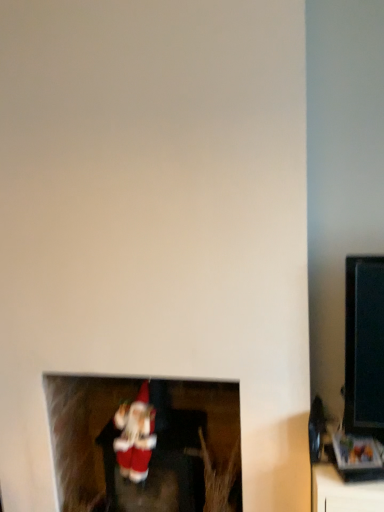
What is the approximate width of red plush santa at lower center?

22.10 centimeters.

Measure the distance between point (118, 411) and camera.

Point (118, 411) and camera are 1.79 meters apart from each other.

Find the location of a particular element. red plush santa at lower center is located at coordinates (135, 436).

Based on the photo, measure the distance between red plush santa at lower center and camera.

They are 1.63 meters apart.

This screenshot has width=384, height=512. What do you see at coordinates (135, 436) in the screenshot?
I see `red plush santa at lower center` at bounding box center [135, 436].

You are a GUI agent. You are given a task and a screenshot of the screen. Output one action in this format:
    pyautogui.click(x=<x>, y=<y>)
    Task: Click on the velvet santa at lower center
    The image size is (384, 512).
    Given the screenshot: What is the action you would take?
    pyautogui.click(x=145, y=444)

What do you see at coordinates (145, 444) in the screenshot? I see `velvet santa at lower center` at bounding box center [145, 444].

Identify the location of red plush santa at lower center. (135, 436).

Which object is positioned more to the left, red plush santa at lower center or velvet santa at lower center?

red plush santa at lower center.

Who is more distant, red plush santa at lower center or velvet santa at lower center?

velvet santa at lower center.

Considering the positions of points (148, 456) and (107, 503), is point (148, 456) farther from camera compared to point (107, 503)?

That is False.

From the image's perspective, is red plush santa at lower center located above velvet santa at lower center?

Correct, red plush santa at lower center appears higher than velvet santa at lower center in the image.

From a real-world perspective, which is physically below, red plush santa at lower center or velvet santa at lower center?

In real-world perspective, velvet santa at lower center is lower.

Does red plush santa at lower center have a greater width compared to velvet santa at lower center?

Incorrect, the width of red plush santa at lower center does not surpass that of velvet santa at lower center.

Who is shorter, red plush santa at lower center or velvet santa at lower center?

Standing shorter between the two is red plush santa at lower center.

Looking at the image, does red plush santa at lower center seem bigger or smaller compared to velvet santa at lower center?

Considering their sizes, red plush santa at lower center takes up less space than velvet santa at lower center.

Is red plush santa at lower center spatially inside velvet santa at lower center, or outside of it?

red plush santa at lower center fits inside velvet santa at lower center.

Are red plush santa at lower center and velvet santa at lower center located far from each other?

That's not correct — red plush santa at lower center is a little close to velvet santa at lower center.

Is red plush santa at lower center aimed at velvet santa at lower center?

Yes, red plush santa at lower center faces towards velvet santa at lower center.

How different are the orientations of red plush santa at lower center and velvet santa at lower center in degrees?

2.26 degrees separate the facing orientations of red plush santa at lower center and velvet santa at lower center.

This screenshot has height=512, width=384. I want to click on fireplace that appears on the right of red plush santa at lower center, so click(x=145, y=444).

Is velvet santa at lower center at the right side of red plush santa at lower center?

Yes, velvet santa at lower center is to the right of red plush santa at lower center.

Which object is closer to the camera taking this photo, velvet santa at lower center or red plush santa at lower center?

red plush santa at lower center is closer to the camera.

Is point (91, 377) closer or farther from the camera than point (129, 435)?

Clearly, point (91, 377) is more distant from the camera than point (129, 435).

From the image's perspective, which is above, velvet santa at lower center or red plush santa at lower center?

red plush santa at lower center is shown above in the image.

From a real-world perspective, relative to red plush santa at lower center, is velvet santa at lower center vertically above or below?

In terms of real-world spatial position, velvet santa at lower center is below red plush santa at lower center.

Considering the relative sizes of velvet santa at lower center and red plush santa at lower center in the image provided, is velvet santa at lower center wider than red plush santa at lower center?

Indeed, velvet santa at lower center has a greater width compared to red plush santa at lower center.

Is velvet santa at lower center taller than red plush santa at lower center?

Yes.

Considering the sizes of objects velvet santa at lower center and red plush santa at lower center in the image provided, who is smaller, velvet santa at lower center or red plush santa at lower center?

With smaller size is red plush santa at lower center.

Which is correct: velvet santa at lower center is inside red plush santa at lower center, or outside of it?

velvet santa at lower center lies outside red plush santa at lower center.

Are velvet santa at lower center and red plush santa at lower center beside each other?

No, velvet santa at lower center is not in contact with red plush santa at lower center.

Is velvet santa at lower center positioned with its back to red plush santa at lower center?

Yes.

Find the location of `santa claus located above the velvet santa at lower center (from the image's perspective)`. santa claus located above the velvet santa at lower center (from the image's perspective) is located at coordinates (135, 436).

At what (x,y) coordinates should I click in order to perform the action: click on santa claus that is in front of the velvet santa at lower center. Please return your answer as a coordinate pair (x, y). Looking at the image, I should click on (135, 436).

The width and height of the screenshot is (384, 512). What are the coordinates of `fireplace on the right of red plush santa at lower center` in the screenshot? It's located at (145, 444).